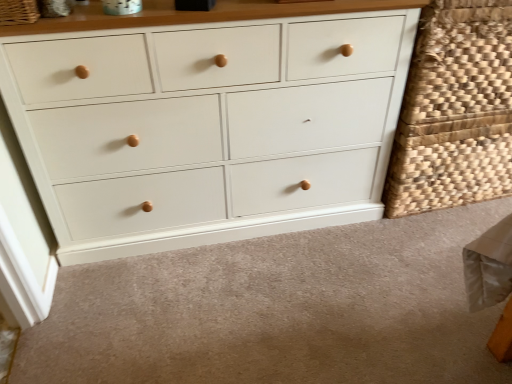
The height and width of the screenshot is (384, 512). Identify the location of white painted wood chest of drawers at center. (206, 125).

You are a GUI agent. You are given a task and a screenshot of the screen. Output one action in this format:
    pyautogui.click(x=<x>, y=<y>)
    Task: Click on the woven natural basket at right, which is counted as the second basket, starting from the front
    The height and width of the screenshot is (384, 512).
    Given the screenshot: What is the action you would take?
    pyautogui.click(x=455, y=110)

Locate an element on the screen. woven natural fiber basket at upper left, acting as the 2th basket starting from the back is located at coordinates [18, 12].

The width and height of the screenshot is (512, 384). Identify the location of white matte drawer at lower center. (277, 310).

Is woven natural basket at right, which is counted as the second basket, starting from the front, turned away from white matte drawer at lower center?

No, woven natural basket at right, which is counted as the second basket, starting from the front, is not facing the opposite direction of white matte drawer at lower center.

Based on the photo, which object is positioned more to the left, woven natural basket at right, which is counted as the second basket, starting from the front, or white matte drawer at lower center?

white matte drawer at lower center is more to the left.

Measure the distance from woven natural basket at right, marked as the second basket in a left-to-right arrangement, to white matte drawer at lower center.

59.41 centimeters.

Considering the relative sizes of woven natural basket at right, marked as the second basket in a left-to-right arrangement, and white matte drawer at lower center in the image provided, is woven natural basket at right, marked as the second basket in a left-to-right arrangement, taller than white matte drawer at lower center?

Yes, woven natural basket at right, marked as the second basket in a left-to-right arrangement, is taller than white matte drawer at lower center.

Which object is closer to the camera, woven natural fiber basket at upper left, positioned as the 1th basket in front-to-back order, or white painted wood chest of drawers at center?

woven natural fiber basket at upper left, positioned as the 1th basket in front-to-back order, is more forward.

Which is more to the left, woven natural fiber basket at upper left, positioned as the 2th basket in right-to-left order, or white painted wood chest of drawers at center?

woven natural fiber basket at upper left, positioned as the 2th basket in right-to-left order.

Are woven natural fiber basket at upper left, positioned as the 1th basket in front-to-back order, and white painted wood chest of drawers at center far apart?

No.

From the picture: Is the depth of white matte drawer at lower center greater than that of woven natural basket at right, which is the 1th basket from back to front?

No, white matte drawer at lower center is closer to the camera.

From the image's perspective, between white matte drawer at lower center and woven natural basket at right, which is counted as the second basket, starting from the front, who is located below?

white matte drawer at lower center.

Who is bigger, white matte drawer at lower center or woven natural basket at right, which is the 1th basket from back to front?

woven natural basket at right, which is the 1th basket from back to front.

Locate an element on the screen. The height and width of the screenshot is (384, 512). plain on the right side of woven natural fiber basket at upper left, marked as the 1th basket in a left-to-right arrangement is located at coordinates (277, 310).

From the image's perspective, would you say white matte drawer at lower center is shown under woven natural fiber basket at upper left, marked as the 1th basket in a left-to-right arrangement?

Yes, from the image's perspective, white matte drawer at lower center is below woven natural fiber basket at upper left, marked as the 1th basket in a left-to-right arrangement.

From a real-world perspective, is white matte drawer at lower center physically below woven natural fiber basket at upper left, marked as the 1th basket in a left-to-right arrangement?

Correct, in the physical world, white matte drawer at lower center is lower than woven natural fiber basket at upper left, marked as the 1th basket in a left-to-right arrangement.

Considering the sizes of objects white matte drawer at lower center and woven natural fiber basket at upper left, positioned as the 1th basket in front-to-back order, in the image provided, who is shorter, white matte drawer at lower center or woven natural fiber basket at upper left, positioned as the 1th basket in front-to-back order,?

white matte drawer at lower center.

Between white painted wood chest of drawers at center and woven natural basket at right, marked as the 1th basket in a right-to-left arrangement, which one has more height?

white painted wood chest of drawers at center.

Image resolution: width=512 pixels, height=384 pixels. Identify the location of chest of drawers in front of the woven natural basket at right, which is the 1th basket from back to front. (206, 125).

Considering their positions, is white painted wood chest of drawers at center located in front of or behind woven natural basket at right, marked as the second basket in a left-to-right arrangement?

Clearly, white painted wood chest of drawers at center is in front of woven natural basket at right, marked as the second basket in a left-to-right arrangement.

Is woven natural fiber basket at upper left, positioned as the 1th basket in front-to-back order, a part of woven natural basket at right, which is counted as the second basket, starting from the front?

Actually, woven natural fiber basket at upper left, positioned as the 1th basket in front-to-back order, is outside woven natural basket at right, which is counted as the second basket, starting from the front.

Is point (486, 162) positioned before point (2, 10)?

No, (486, 162) is behind (2, 10).

Based on the photo, is woven natural basket at right, which is the 1th basket from back to front, oriented towards woven natural fiber basket at upper left, positioned as the 1th basket in front-to-back order?

No, woven natural basket at right, which is the 1th basket from back to front, is not aimed at woven natural fiber basket at upper left, positioned as the 1th basket in front-to-back order.

Does woven natural basket at right, which is the 1th basket from back to front, have a smaller size compared to woven natural fiber basket at upper left, positioned as the 1th basket in front-to-back order?

Actually, woven natural basket at right, which is the 1th basket from back to front, might be larger than woven natural fiber basket at upper left, positioned as the 1th basket in front-to-back order.

Which is correct: white painted wood chest of drawers at center is inside white matte drawer at lower center, or outside of it?

white painted wood chest of drawers at center is located beyond the bounds of white matte drawer at lower center.

At what (x,y) coordinates should I click in order to perform the action: click on the chest of drawers that is behind the white matte drawer at lower center. Please return your answer as a coordinate pair (x, y). Image resolution: width=512 pixels, height=384 pixels. Looking at the image, I should click on (206, 125).

Which object is more forward, white painted wood chest of drawers at center or white matte drawer at lower center?

white matte drawer at lower center is in front.

In the image, there is a woven natural basket at right, which is counted as the second basket, starting from the front. Identify the location of plain below it (from a real-world perspective). (277, 310).

This screenshot has height=384, width=512. In order to click on basket lying in front of the white painted wood chest of drawers at center in this screenshot , I will do `click(18, 12)`.

Which object lies further to the anchor point white painted wood chest of drawers at center, woven natural basket at right, marked as the 1th basket in a right-to-left arrangement, or white matte drawer at lower center?

woven natural basket at right, marked as the 1th basket in a right-to-left arrangement.

Looking at the image, which one is located further to woven natural basket at right, marked as the second basket in a left-to-right arrangement, white matte drawer at lower center or woven natural fiber basket at upper left, marked as the 1th basket in a left-to-right arrangement?

Among the two, woven natural fiber basket at upper left, marked as the 1th basket in a left-to-right arrangement, is located further to woven natural basket at right, marked as the second basket in a left-to-right arrangement.

When comparing their distances from woven natural fiber basket at upper left, acting as the 2th basket starting from the back, does white painted wood chest of drawers at center or white matte drawer at lower center seem closer?

white painted wood chest of drawers at center is positioned closer to the anchor woven natural fiber basket at upper left, acting as the 2th basket starting from the back.

Based on their spatial positions, is white matte drawer at lower center or woven natural basket at right, which is counted as the second basket, starting from the front, closer to woven natural fiber basket at upper left, positioned as the 2th basket in right-to-left order?

white matte drawer at lower center is closer to woven natural fiber basket at upper left, positioned as the 2th basket in right-to-left order.

Based on their spatial positions, is woven natural fiber basket at upper left, acting as the 2th basket starting from the back, or woven natural basket at right, which is counted as the second basket, starting from the front, further from white matte drawer at lower center?

Based on the image, woven natural fiber basket at upper left, acting as the 2th basket starting from the back, appears to be further to white matte drawer at lower center.

Which object lies further to the anchor point woven natural basket at right, which is counted as the second basket, starting from the front, woven natural fiber basket at upper left, positioned as the 1th basket in front-to-back order, or white painted wood chest of drawers at center?

woven natural fiber basket at upper left, positioned as the 1th basket in front-to-back order, lies further to woven natural basket at right, which is counted as the second basket, starting from the front, than the other object.

Looking at the image, which one is located closer to woven natural basket at right, marked as the 1th basket in a right-to-left arrangement, white painted wood chest of drawers at center or woven natural fiber basket at upper left, positioned as the 2th basket in right-to-left order?

Based on the image, white painted wood chest of drawers at center appears to be nearer to woven natural basket at right, marked as the 1th basket in a right-to-left arrangement.

Based on the photo, based on their spatial positions, is white painted wood chest of drawers at center or white matte drawer at lower center closer to woven natural basket at right, marked as the second basket in a left-to-right arrangement?

Among the two, white painted wood chest of drawers at center is located nearer to woven natural basket at right, marked as the second basket in a left-to-right arrangement.

Locate an element on the screen. The height and width of the screenshot is (384, 512). plain between woven natural fiber basket at upper left, positioned as the 2th basket in right-to-left order, and woven natural basket at right, which is counted as the second basket, starting from the front is located at coordinates (277, 310).

At what (x,y) coordinates should I click in order to perform the action: click on the chest of drawers located between woven natural fiber basket at upper left, positioned as the 1th basket in front-to-back order, and woven natural basket at right, which is the 1th basket from back to front, in the left-right direction. Please return your answer as a coordinate pair (x, y). The width and height of the screenshot is (512, 384). Looking at the image, I should click on (206, 125).

Where is `plain situated between white painted wood chest of drawers at center and woven natural basket at right, which is counted as the second basket, starting from the front, from left to right`? The width and height of the screenshot is (512, 384). plain situated between white painted wood chest of drawers at center and woven natural basket at right, which is counted as the second basket, starting from the front, from left to right is located at coordinates (277, 310).

Locate an element on the screen. the chest of drawers located between woven natural fiber basket at upper left, positioned as the 1th basket in front-to-back order, and white matte drawer at lower center in the left-right direction is located at coordinates (206, 125).